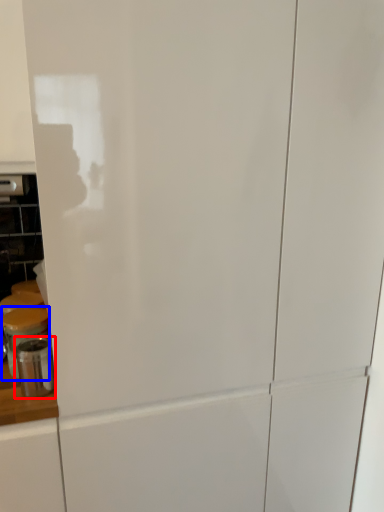
Question: Among these objects, which one is farthest to the camera, appliance (highlighted by a red box) or appliance (highlighted by a blue box)?

Choices:
 (A) appliance
 (B) appliance

Answer: (B)